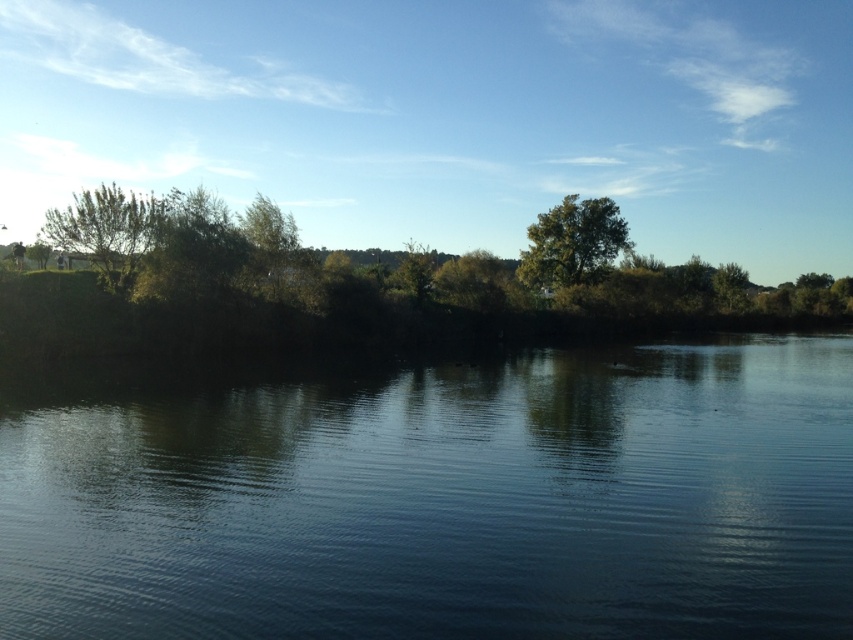
You are standing at the edge of the water and want to locate the dark blue water at center. According to the coordinates provided, in which direction should you look relative to your position?

The dark blue water at center is located at coordinates point [433,496], so you should look slightly to the right and slightly downward from your current position at the edge.

You are standing at the edge of the water and see the dark blue water at center and the green leafy tree at center. Which object is positioned to the left of the other?

The dark blue water at center is to the left of the green leafy tree at center.